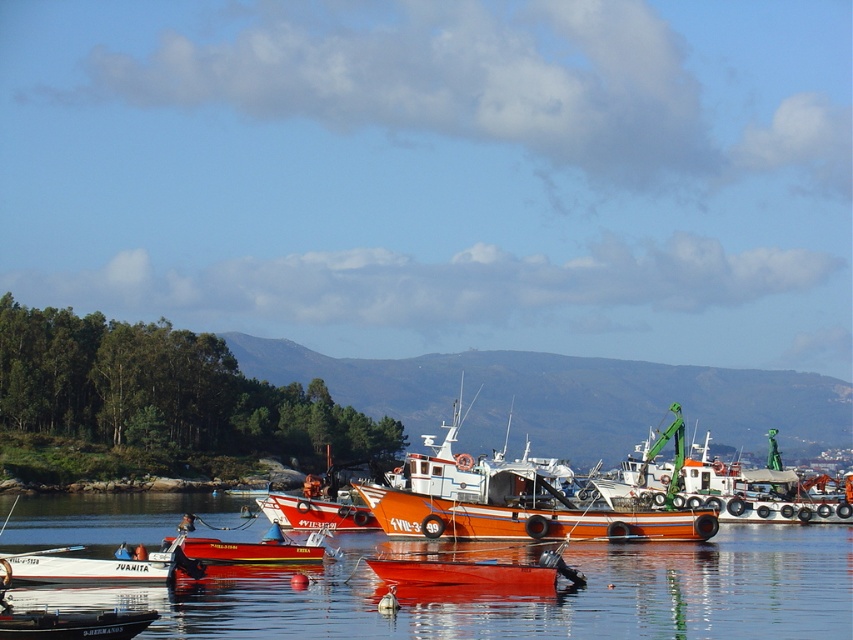
You are standing on the dock and see the glossy water at center and the orange matte fishing boat at center. Which object is positioned higher from the dock? Please explain based on their spatial relationship.

The orange matte fishing boat at center is positioned higher than the glossy water at center because the water is located below the boat.

You are a photographer trying to capture the orange matte fishing boat at center and the glossy water at center. Based on the scene, which object appears closer to the camera?

The orange matte fishing boat at center appears closer to the camera than the glossy water at center because it is taller than the glossy water at center.